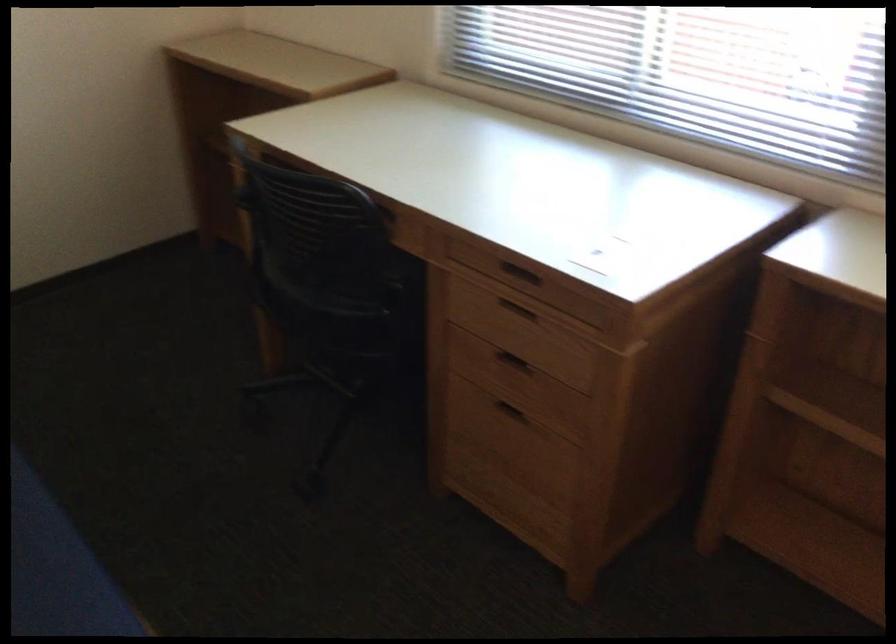
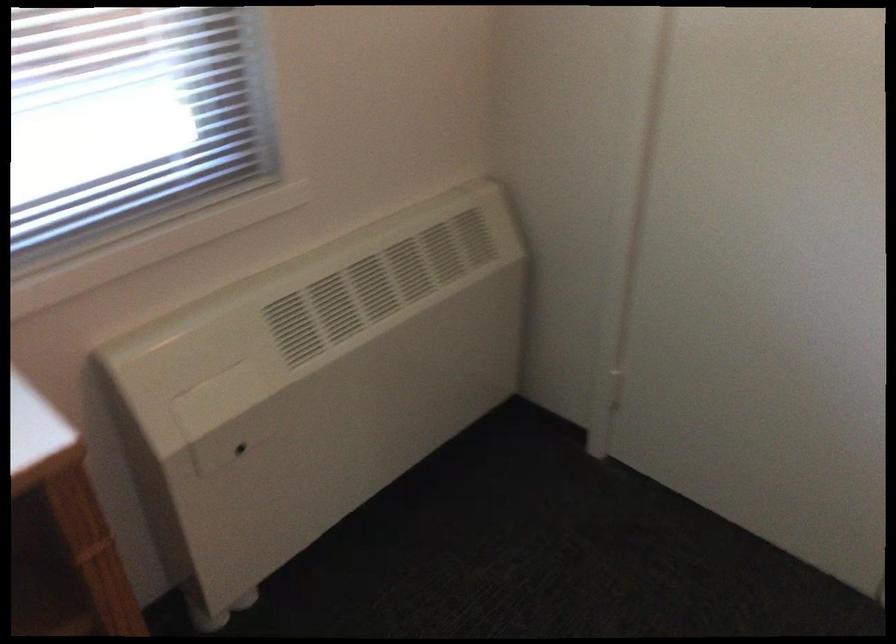
How did the camera likely rotate?

The rotation direction of the camera is right-down.